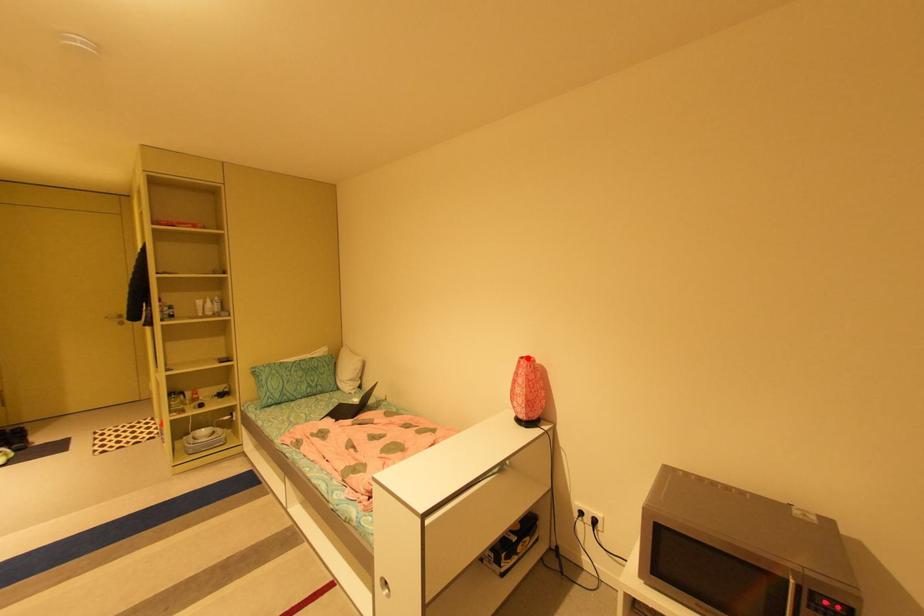
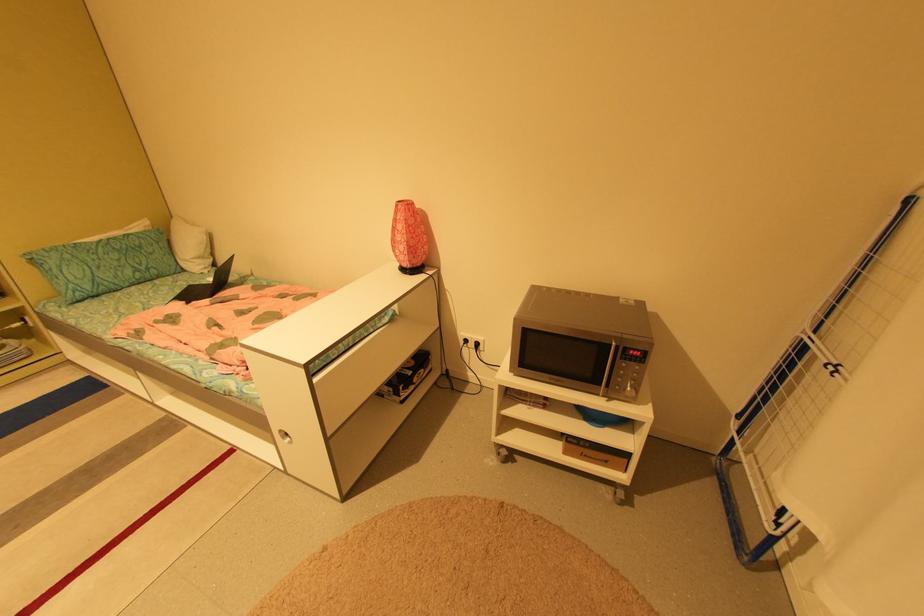
Where in the second image is the point corresponding to the highlighted location from the first image?

(406, 201)